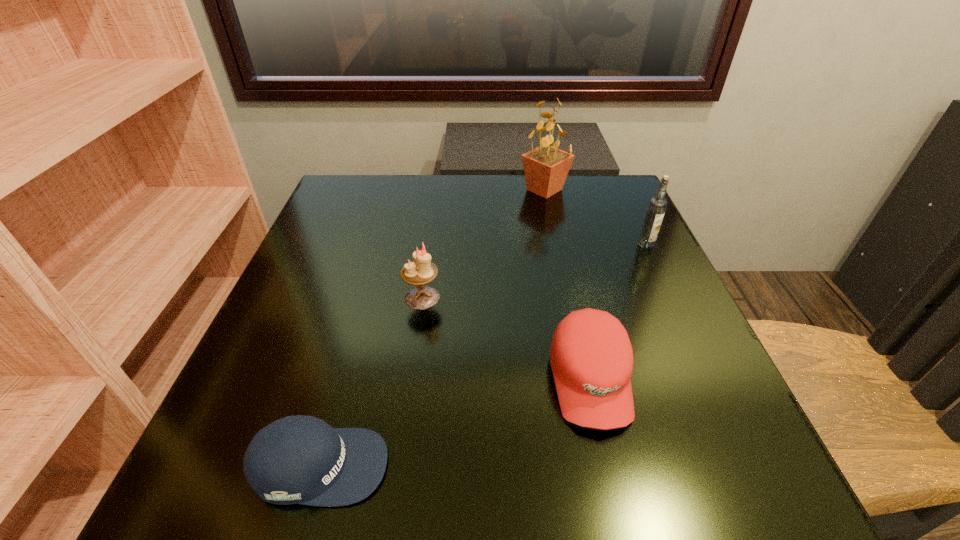
What are the coordinates of `free space between the baseball cap and the cap` in the screenshot? It's located at (455, 423).

Find the location of `free space between the vodka and the shortest object`. free space between the vodka and the shortest object is located at coordinates (483, 355).

The image size is (960, 540). I want to click on free space between the shortest object and the farthest object, so click(432, 328).

Locate an element on the screen. free space between the second tallest object and the fourth tallest object is located at coordinates (618, 313).

Where is `free spot between the fourth shortest object and the shortest object`? free spot between the fourth shortest object and the shortest object is located at coordinates (483, 355).

You are a GUI agent. You are given a task and a screenshot of the screen. Output one action in this format:
    pyautogui.click(x=<x>, y=<y>)
    Task: Click on the vacant space that is in between the fourth tallest object and the tallest object
    The height and width of the screenshot is (540, 960).
    Given the screenshot: What is the action you would take?
    tap(567, 285)

The width and height of the screenshot is (960, 540). I want to click on vacant space in between the shortest object and the tallest object, so click(432, 328).

The image size is (960, 540). Find the location of `free space between the shortest object and the third tallest object`. free space between the shortest object and the third tallest object is located at coordinates (371, 382).

This screenshot has height=540, width=960. Find the location of `object that is the third nearest to the sunflower`. object that is the third nearest to the sunflower is located at coordinates (591, 357).

Locate which object is the closest to the baseball cap. Please provide its 2D coordinates. Your answer should be formatted as a tuple, i.e. [(x, y)], where the tuple contains the x and y coordinates of a point satisfying the conditions above.

[(591, 357)]